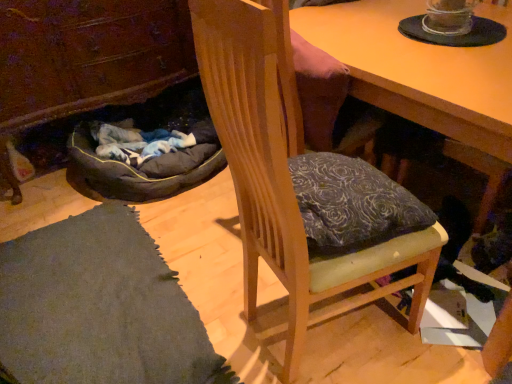
Question: Is wooden desk at center a part of wooden cabinet at lower left?

Choices:
 (A) no
 (B) yes

Answer: (A)

Question: Is wooden cabinet at lower left smaller than wooden desk at center?

Choices:
 (A) no
 (B) yes

Answer: (B)

Question: Is wooden cabinet at lower left not near wooden desk at center?

Choices:
 (A) yes
 (B) no

Answer: (A)

Question: Is wooden desk at center at the back of wooden cabinet at lower left?

Choices:
 (A) yes
 (B) no

Answer: (B)

Question: From the image's perspective, would you say wooden cabinet at lower left is shown under wooden desk at center?

Choices:
 (A) no
 (B) yes

Answer: (A)

Question: Considering the positions of wooden cabinet at lower left and wooden desk at center in the image, is wooden cabinet at lower left wider or thinner than wooden desk at center?

Choices:
 (A) thin
 (B) wide

Answer: (A)

Question: From the image's perspective, is wooden cabinet at lower left positioned above or below wooden desk at center?

Choices:
 (A) above
 (B) below

Answer: (A)

Question: Is wooden cabinet at lower left to the left or to the right of wooden desk at center in the image?

Choices:
 (A) right
 (B) left

Answer: (B)

Question: In the image, is wooden cabinet at lower left positioned in front of or behind wooden desk at center?

Choices:
 (A) behind
 (B) front

Answer: (A)

Question: Based on their sizes in the image, would you say wooden cabinet at lower left is bigger or smaller than wooden chair at center?

Choices:
 (A) big
 (B) small

Answer: (A)

Question: From a real-world perspective, is wooden cabinet at lower left physically located above or below wooden chair at center?

Choices:
 (A) below
 (B) above

Answer: (A)

Question: Is wooden cabinet at lower left in front of or behind wooden chair at center in the image?

Choices:
 (A) front
 (B) behind

Answer: (B)

Question: In terms of width, does wooden cabinet at lower left look wider or thinner when compared to wooden chair at center?

Choices:
 (A) thin
 (B) wide

Answer: (B)

Question: Is wooden desk at center taller or shorter than wooden cabinet at lower left?

Choices:
 (A) short
 (B) tall

Answer: (A)

Question: In terms of width, does wooden desk at center look wider or thinner when compared to wooden cabinet at lower left?

Choices:
 (A) thin
 (B) wide

Answer: (B)